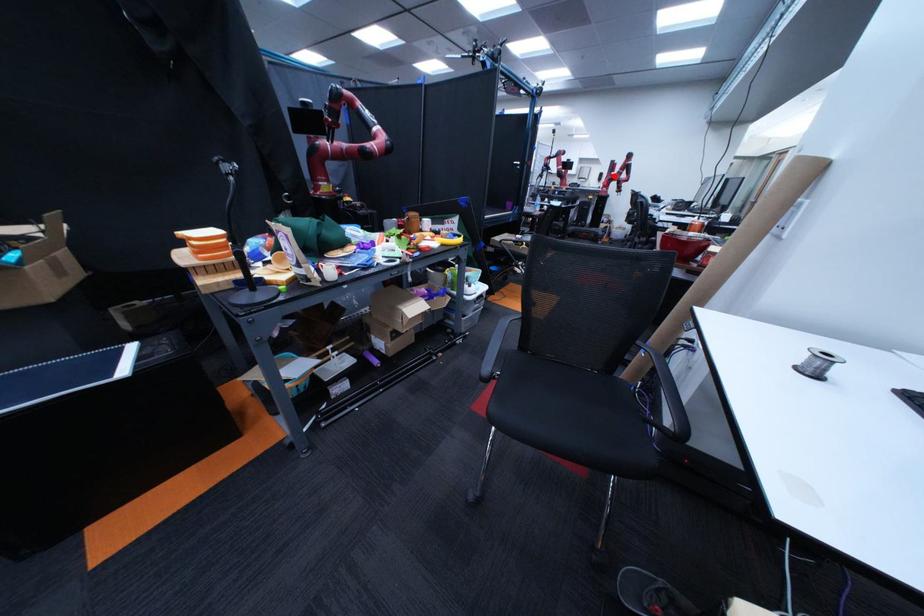
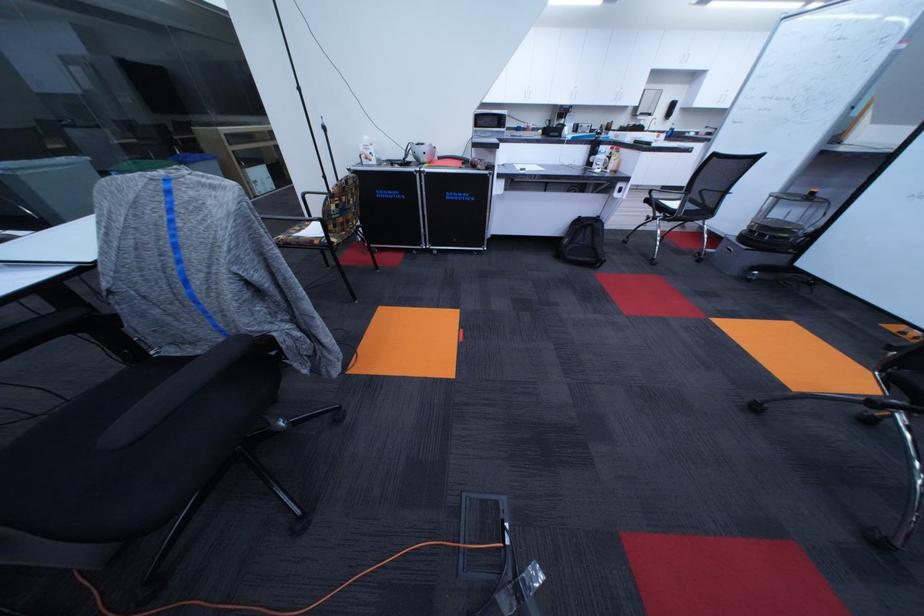
The point at the highlighted location is marked in the first image. Where is the corresponding point in the second image?

(686, 107)